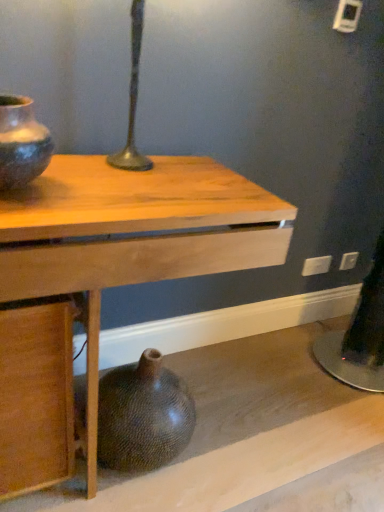
You are a GUI agent. You are given a task and a screenshot of the screen. Output one action in this format:
    pyautogui.click(x=<x>, y=<y>)
    Task: Click on the spots to the right of brown textured vase at lower center, which is the first vase from bottom to top
    
    Given the screenshot: What is the action you would take?
    pyautogui.click(x=232, y=446)